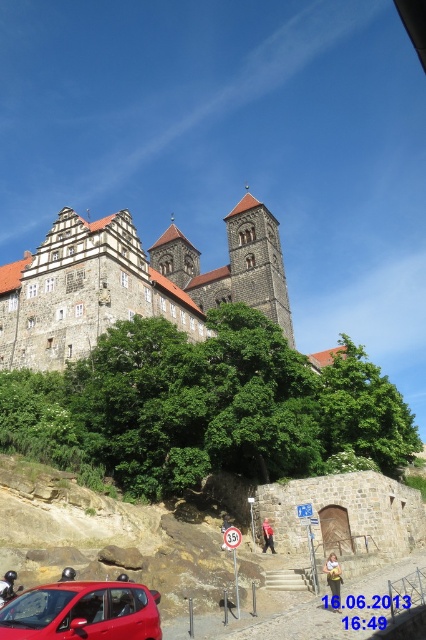
Who is positioned more to the left, stone castle at upper center or brown stone tower at center?

stone castle at upper center is more to the left.

Who is higher up, stone castle at upper center or brown stone tower at center?

stone castle at upper center is higher up.

Between point (78, 225) and point (267, 301), which one is positioned in front?

Point (78, 225)

The width and height of the screenshot is (426, 640). What are the coordinates of `stone castle at upper center` in the screenshot? It's located at (132, 284).

Is stone castle at upper center bigger than shiny red car at lower left?

Yes, stone castle at upper center is bigger than shiny red car at lower left.

Who is positioned more to the right, stone castle at upper center or shiny red car at lower left?

From the viewer's perspective, stone castle at upper center appears more on the right side.

Measure the distance between stone castle at upper center and camera.

stone castle at upper center and camera are 187.54 feet apart.

Where is `stone castle at upper center`? The height and width of the screenshot is (640, 426). stone castle at upper center is located at coordinates (132, 284).

Who is higher up, shiny red car at lower left or brown stone tower at center?

Positioned higher is brown stone tower at center.

Between point (158, 637) and point (290, 312), which one is positioned behind?

The point (290, 312) is behind.

Identify the location of shiny red car at lower left. The image size is (426, 640). (83, 612).